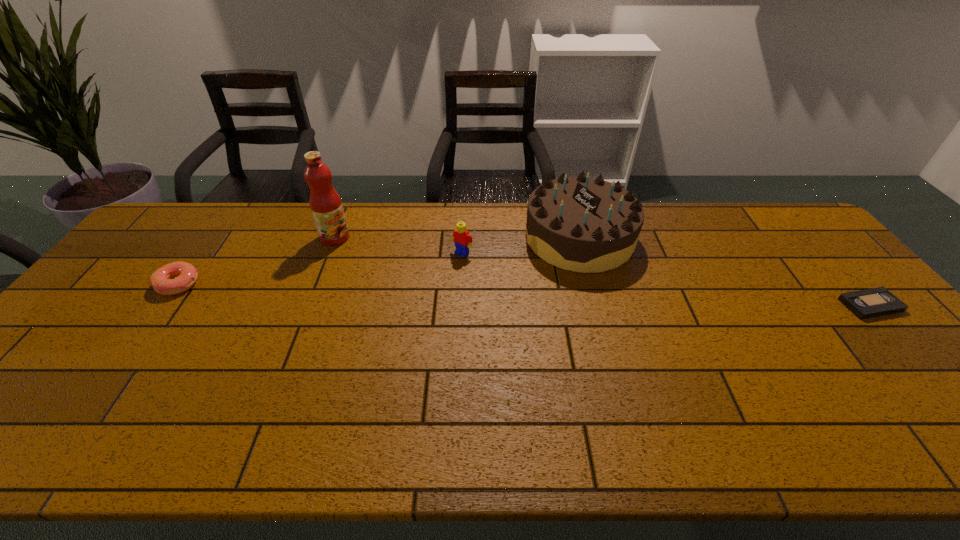
Find the location of a particular element. Image resolution: width=960 pixels, height=540 pixels. free space on the desktop that is between the leftmost object and the rightmost object and is positioned on the front label of the fruit juice is located at coordinates (423, 292).

I want to click on free space on the desktop that is between the doughnut and the videotape and is positioned on the front-facing side of the second tallest object, so coord(508,294).

At what (x,y) coordinates should I click in order to perform the action: click on free space on the desktop that is between the leftmost object and the videotape and is positioned on the front-facing side of the Lego. Please return your answer as a coordinate pair (x, y). Looking at the image, I should click on (424, 292).